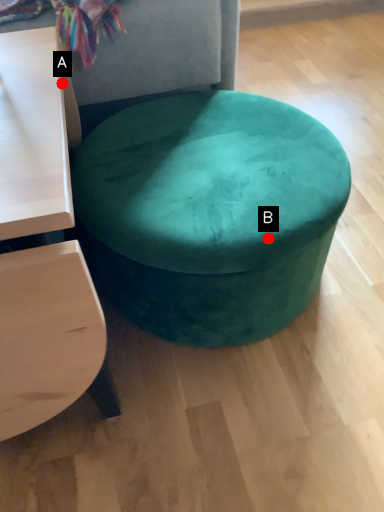
Question: Two points are circled on the image, labeled by A and B beside each circle. Which point appears farthest from the camera in this image?

Choices:
 (A) A is further
 (B) B is further

Answer: (A)